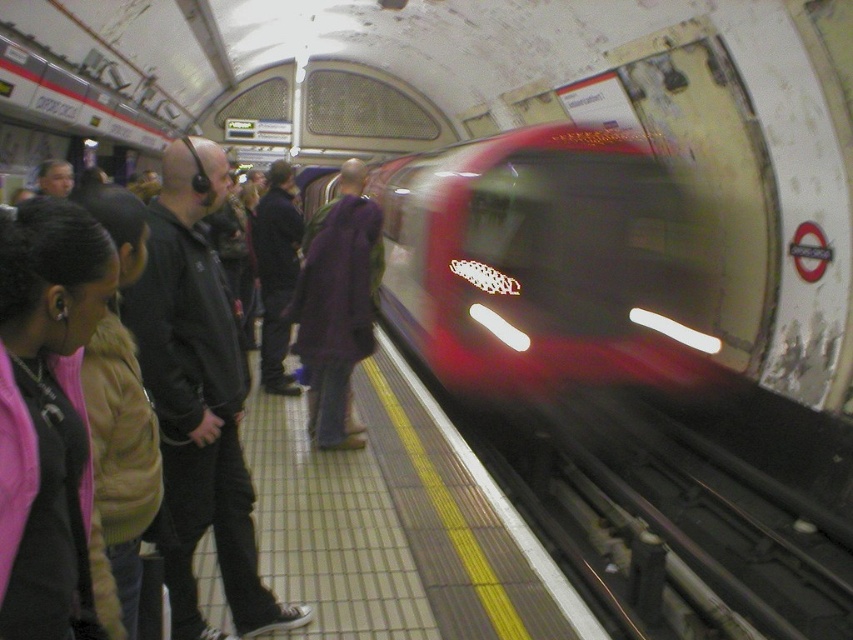
You are a fashion designer observing two purple garments on a subway platform. The purple wool coat at center and the purple fabric jacket at center are both in view. Which one appears bigger in size?

The purple wool coat at center appears bigger in size compared to the purple fabric jacket at center.

You are standing at the point marked as point (198, 397) in the subway station. What object is located to your left side?

The black leather jacket at left is located to your left side at point (198, 397).

You are a fashion designer observing the subway station scene. You notice two jackets worn by passengers. The black leather jacket at left and the purple fabric jacket at center. Which jacket is narrower in width?

The black leather jacket at left is narrower in width than the purple fabric jacket at center.